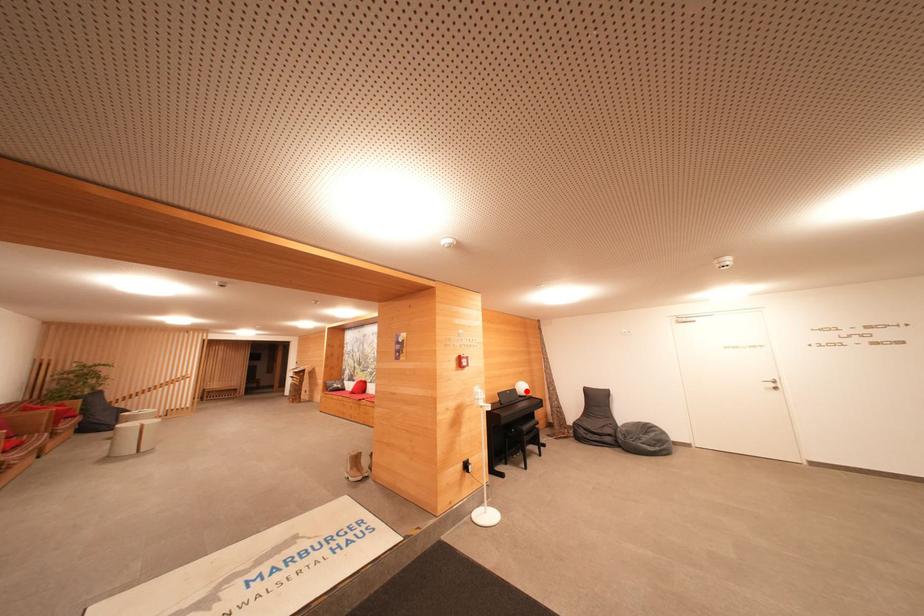
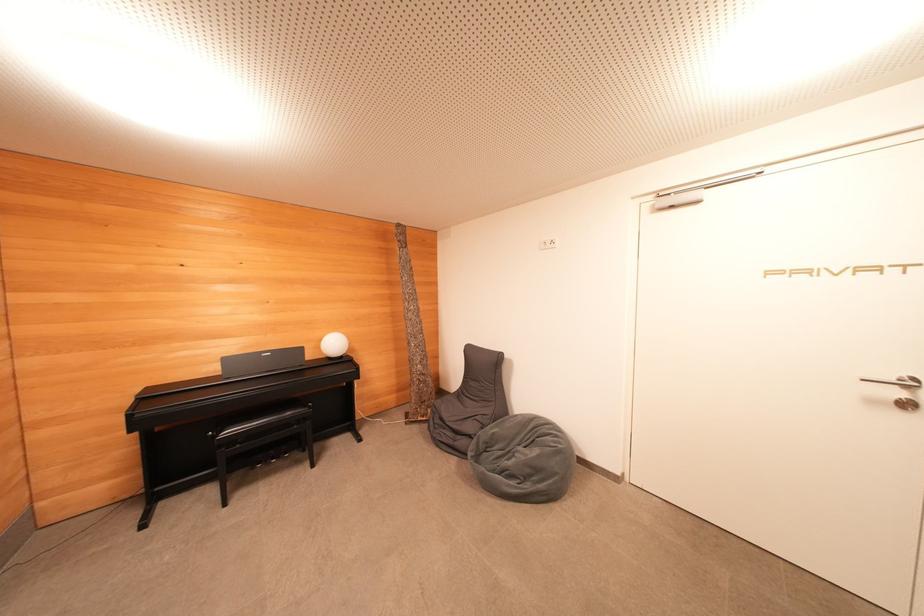
Where in the second image is the point corresponding to the highlighted location from the first image?

(337, 347)